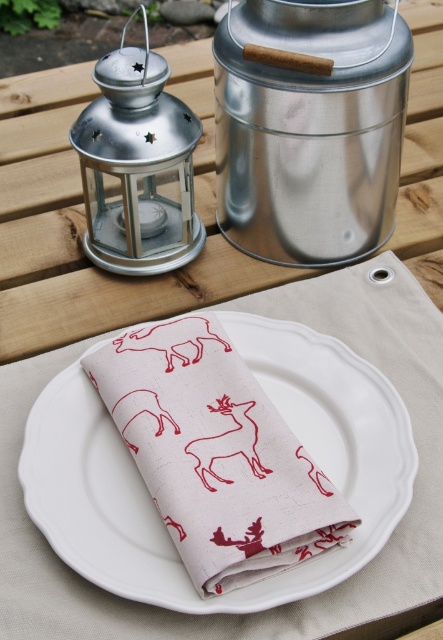
Question: Where is white ceramic plate at center located in relation to metallic lantern at upper left in the image?

Choices:
 (A) below
 (B) above

Answer: (A)

Question: Which point is closer to the camera?

Choices:
 (A) white ceramic plate at center
 (B) metallic lantern at upper left

Answer: (A)

Question: Among these objects, which one is nearest to the camera?

Choices:
 (A) white ceramic plate at center
 (B) metallic silver canister at upper center
 (C) metallic lantern at upper left

Answer: (A)

Question: In this image, where is white ceramic plate at center located relative to metallic lantern at upper left?

Choices:
 (A) left
 (B) right

Answer: (B)

Question: In this image, where is white ceramic plate at center located relative to metallic lantern at upper left?

Choices:
 (A) above
 (B) below

Answer: (B)

Question: Estimate the real-world distances between objects in this image. Which object is farther from the metallic silver canister at upper center?

Choices:
 (A) metallic lantern at upper left
 (B) white ceramic plate at center

Answer: (B)